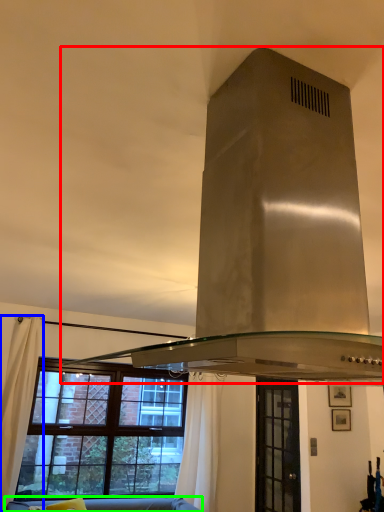
Question: Which object is positioned farthest from exhaust hood (highlighted by a red box)? Select from curtain (highlighted by a blue box) and studio couch (highlighted by a green box).

Choices:
 (A) curtain
 (B) studio couch

Answer: (B)